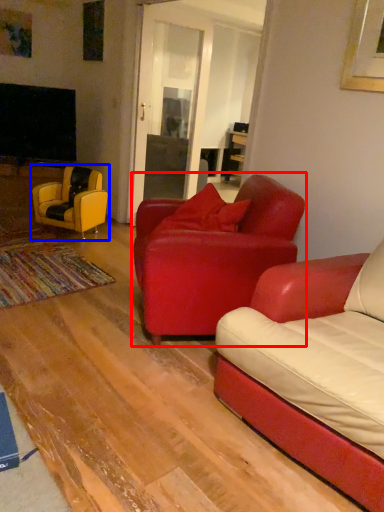
Question: Which point is closer to the camera, chair (highlighted by a red box) or chair (highlighted by a blue box)?

Choices:
 (A) chair
 (B) chair

Answer: (A)